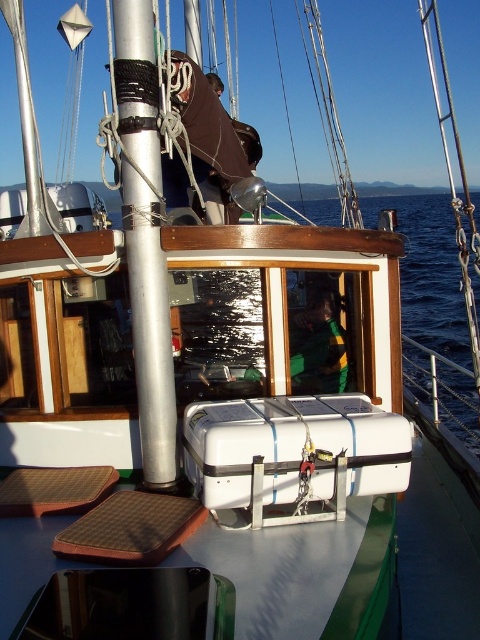
Question: Among these objects, which one is nearest to the camera?

Choices:
 (A) blue water at center
 (B) silver/metallic mast at center
 (C) brown textured mat at lower left
 (D) white plastic cooler at center

Answer: (C)

Question: Among these points, which one is nearest to the camera?

Choices:
 (A) (173, 195)
 (B) (103, 532)

Answer: (B)

Question: In this image, where is brown leather seat at upper center located relative to green fabric at center?

Choices:
 (A) below
 (B) above

Answer: (B)

Question: Does blue water at center appear over brown textured mat at lower left?

Choices:
 (A) no
 (B) yes

Answer: (B)

Question: Which point is farther to the camera?

Choices:
 (A) (335, 339)
 (B) (200, 161)
 (C) (460, 429)

Answer: (C)

Question: Does silver/metallic mast at center have a larger size compared to brown leather seat at upper center?

Choices:
 (A) yes
 (B) no

Answer: (B)